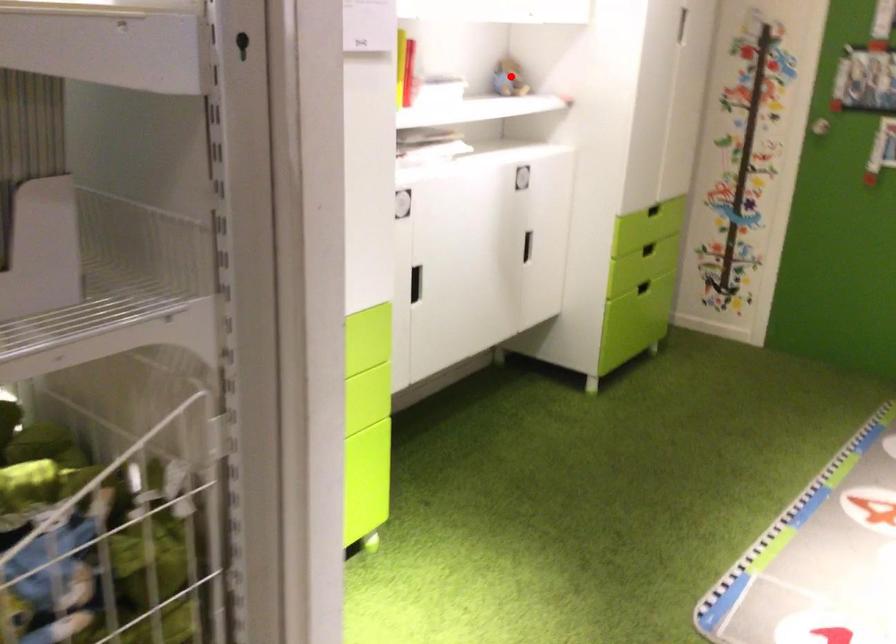
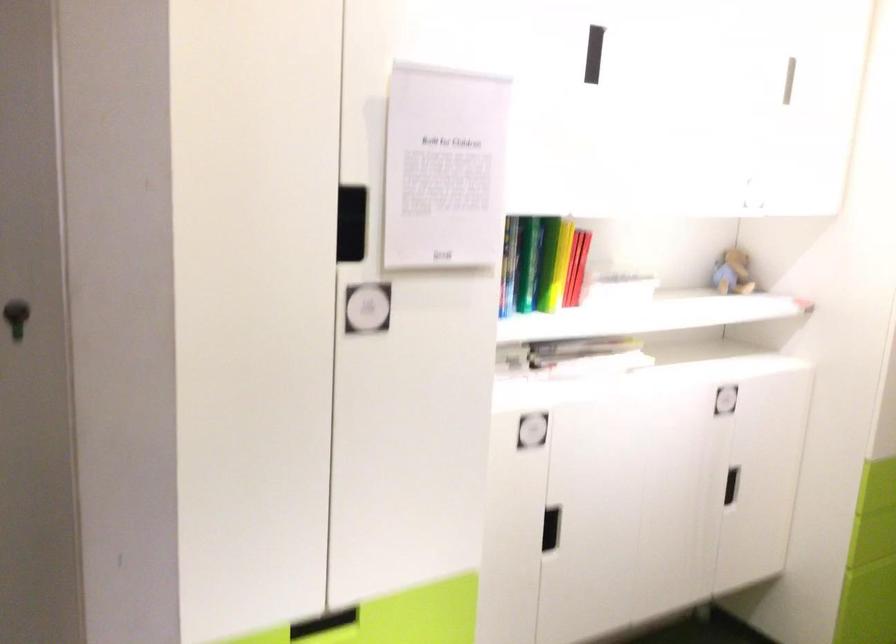
Where in the second image is the point corresponding to the highlighted location from the first image?

(733, 272)